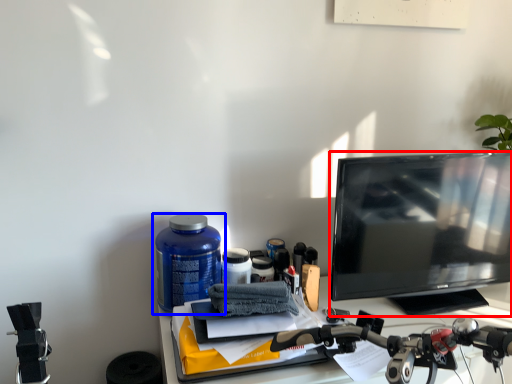
Question: Among these objects, which one is nearest to the camera, television (highlighted by a red box) or bottle (highlighted by a blue box)?

Choices:
 (A) television
 (B) bottle

Answer: (A)